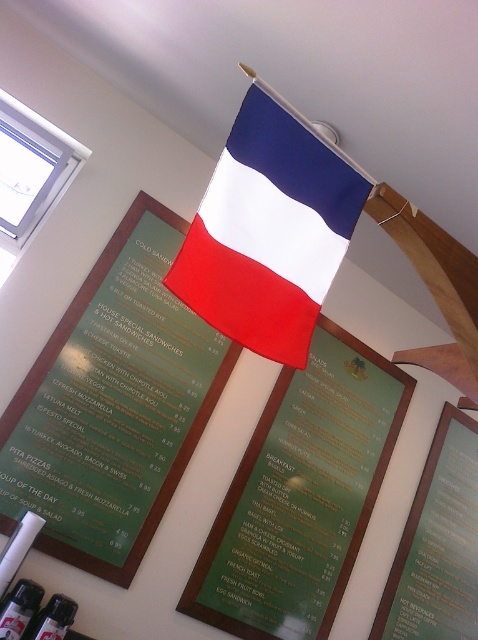
You are standing in front of the wall with the menus and the French flag. You want to take a photo of the green glossy menu at center with your phone, which has a maximum focus distance of 7 feet. Will your phone be able to focus on the menu?

The green glossy menu at center and camera are 7.26 feet apart from each other. Since the maximum focus distance is 7 feet, the phone cannot focus on the menu because it is beyond the 7 feet limit.

You are standing in front of the wall with the menus and the flag. You need to hang a new menu that is 1.5 meters wide between the existing items. Can you fit it between the matte fabric flag at upper center and the green matte menu at center without overlapping?

The distance between the matte fabric flag at upper center and the green matte menu at center is 1.67 meters. Since the new menu is 1.5 meters wide, it can fit between them without overlapping as the space is slightly larger than the menu.